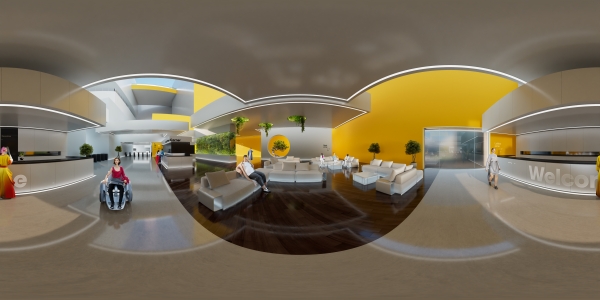
This screenshot has width=600, height=300. What are the coordinates of `sofa` in the screenshot? It's located at (236, 191).